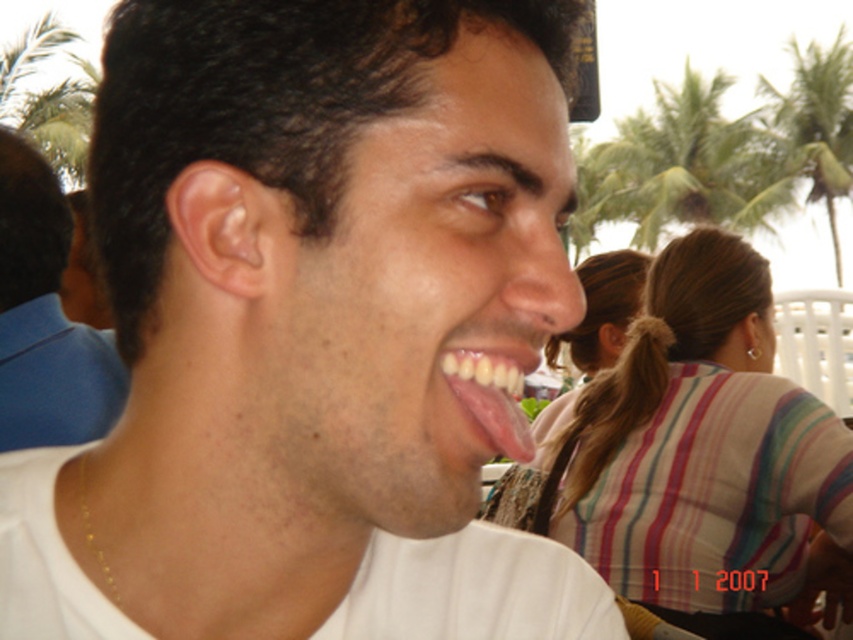
Question: Which of these objects is positioned farthest from the matte white shirt at center?

Choices:
 (A) pink glossy tongue at center
 (B) green leafy palm tree at upper center
 (C) matte blue shirt at left

Answer: (B)

Question: Does matte white shirt at center have a smaller size compared to pink glossy tongue at center?

Choices:
 (A) yes
 (B) no

Answer: (B)

Question: Can you confirm if matte white face at center is bigger than pink glossy tongue at center?

Choices:
 (A) no
 (B) yes

Answer: (B)

Question: Which object is the closest to the pink glossy tongue at center?

Choices:
 (A) matte white shirt at center
 (B) matte blue shirt at left
 (C) green leafy palm tree at upper center
 (D) matte white face at center

Answer: (D)

Question: Which of the following is the closest to the observer?

Choices:
 (A) matte white face at center
 (B) matte white shirt at center
 (C) matte blue shirt at left
 (D) green leafy palm tree at upper center

Answer: (A)

Question: Does green leafy palm tree at upper right have a larger size compared to pink glossy tongue at center?

Choices:
 (A) yes
 (B) no

Answer: (A)